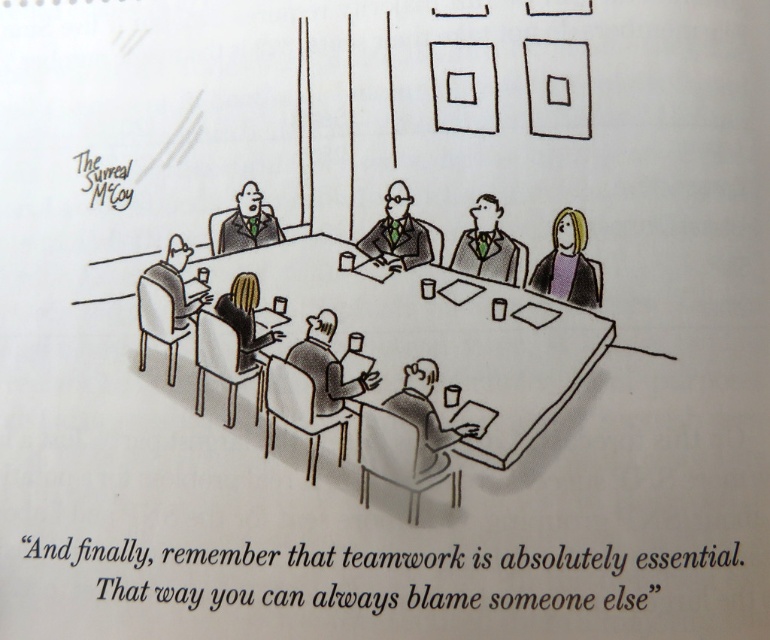
Question: Does shiny metallic bottle at center appear on the left side of black hair at center?

Choices:
 (A) yes
 (B) no

Answer: (B)

Question: Is smooth gray suit at lower center to the right of black hair at center from the viewer's perspective?

Choices:
 (A) yes
 (B) no

Answer: (A)

Question: Is matte black suit at center below matte black chair at left?

Choices:
 (A) yes
 (B) no

Answer: (B)

Question: Which of these objects is positioned closest to the purple fabric shirt at upper right?

Choices:
 (A) smooth gray suit at lower center
 (B) matte black suit at center
 (C) shiny metallic bottle at center

Answer: (B)

Question: Which of the following is the farthest from the observer?

Choices:
 (A) matte black suit at center
 (B) shiny metallic bottle at center
 (C) black hair at center
 (D) smooth gray suit at lower center

Answer: (A)

Question: Which object appears farthest from the camera in this image?

Choices:
 (A) smooth gray suit at upper left
 (B) black hair at center

Answer: (A)